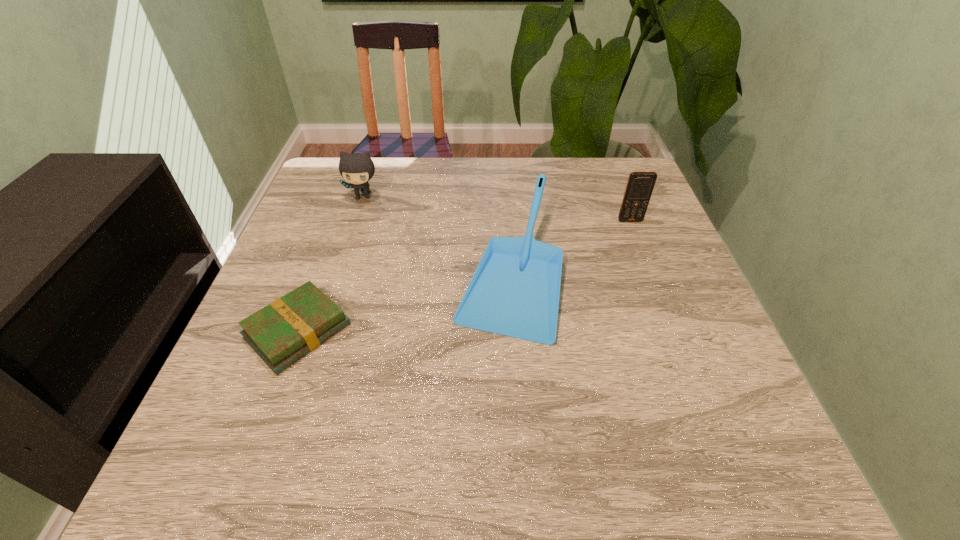
You are a GUI agent. You are given a task and a screenshot of the screen. Output one action in this format:
    pyautogui.click(x=<x>, y=<y>)
    Task: Click on the free space between the kitten and the dustpan
    
    Given the screenshot: What is the action you would take?
    pyautogui.click(x=436, y=233)

Locate an element on the screen. vacant point located between the kitten and the dustpan is located at coordinates (436, 233).

The height and width of the screenshot is (540, 960). Find the location of `vacant region between the rightmost object and the dustpan`. vacant region between the rightmost object and the dustpan is located at coordinates (569, 245).

You are a GUI agent. You are given a task and a screenshot of the screen. Output one action in this format:
    pyautogui.click(x=<x>, y=<y>)
    Task: Click on the empty location between the shortest object and the kitten
    The width and height of the screenshot is (960, 540).
    Given the screenshot: What is the action you would take?
    pyautogui.click(x=330, y=264)

Where is `empty location between the cellular telephone and the shortest object`? empty location between the cellular telephone and the shortest object is located at coordinates (464, 276).

Locate an element on the screen. Image resolution: width=960 pixels, height=540 pixels. free space between the kitten and the cellular telephone is located at coordinates (496, 208).

Where is `empty space that is in between the shortest object and the rightmost object`? empty space that is in between the shortest object and the rightmost object is located at coordinates (464, 276).

Find the location of a particular element. free space that is in between the rightmost object and the dustpan is located at coordinates (569, 245).

Locate an element on the screen. The height and width of the screenshot is (540, 960). free space between the kitten and the second object from right to left is located at coordinates (436, 233).

Find the location of `free spot between the third object from left to right and the cellular telephone`. free spot between the third object from left to right and the cellular telephone is located at coordinates (569, 245).